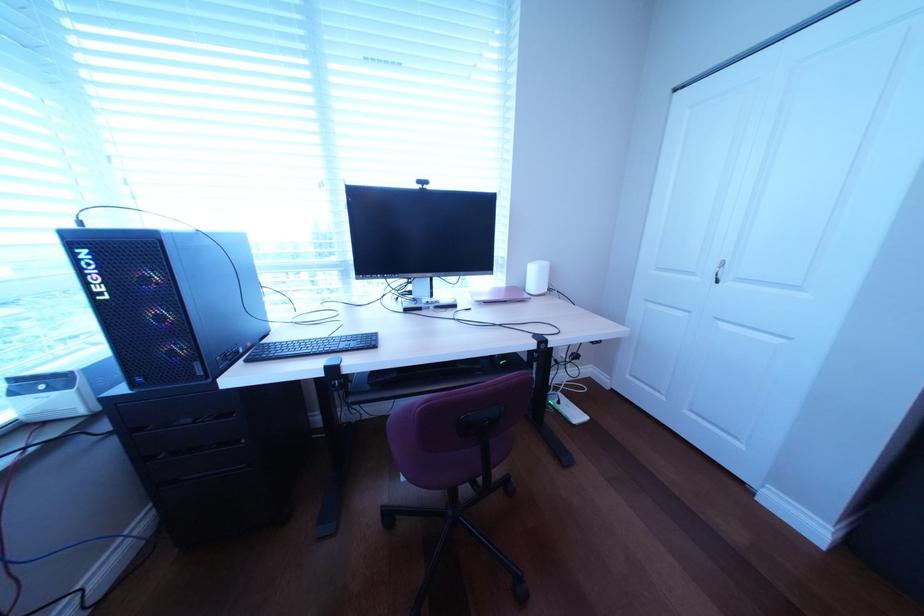
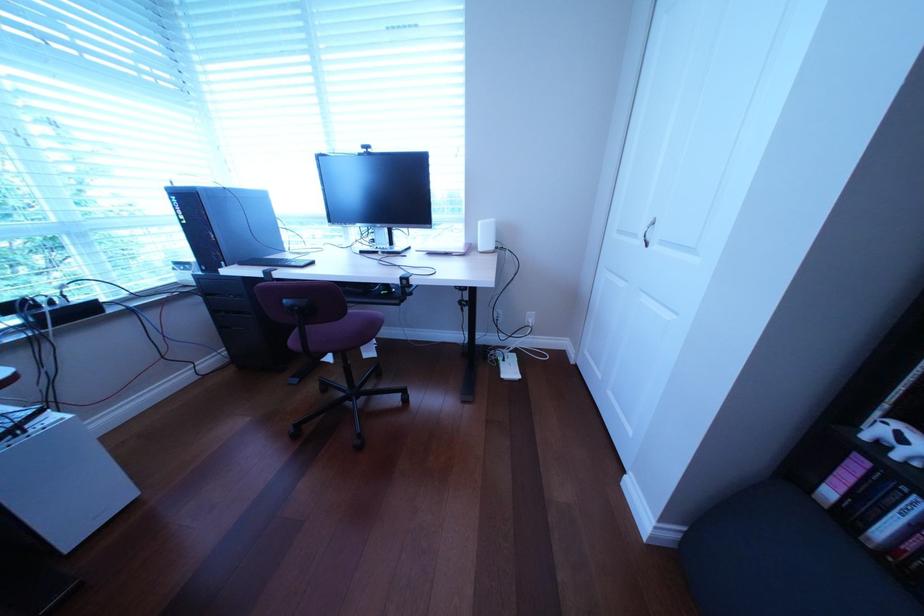
Question: What movement of the cameraman would produce the second image?

Choices:
 (A) Left
 (B) Right
 (C) Forward
 (D) Backward

Answer: (B)